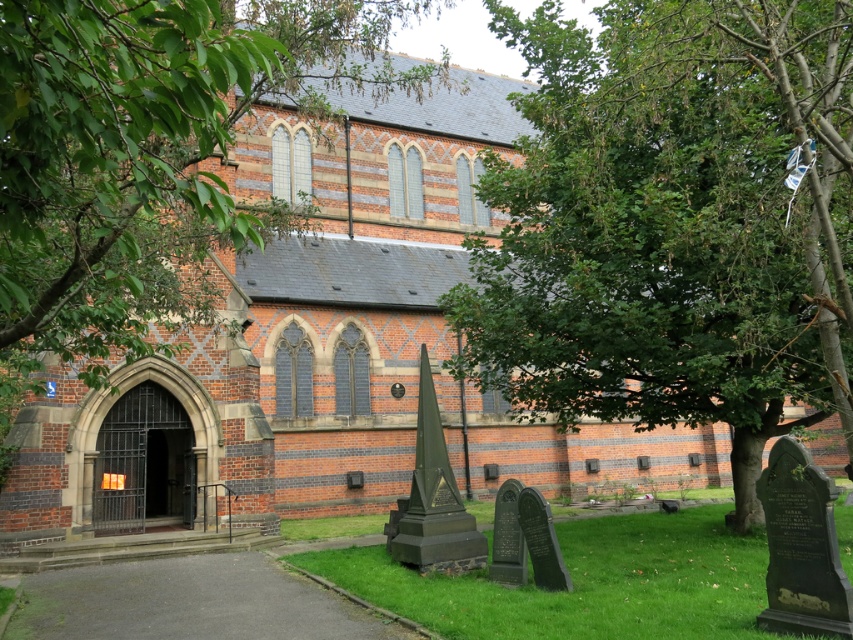
Question: Which of the following is the farthest from the observer?

Choices:
 (A) green grass at center
 (B) green leafy tree at center

Answer: (A)

Question: Can you confirm if green leafy tree at center is smaller than green grass at center?

Choices:
 (A) no
 (B) yes

Answer: (A)

Question: Which of these objects is positioned closest to the green leafy tree at center?

Choices:
 (A) green grass at center
 (B) green leafy tree at upper left

Answer: (A)

Question: Which object is the farthest from the green grass at center?

Choices:
 (A) green leafy tree at center
 (B) green leafy tree at upper left

Answer: (B)

Question: Can you confirm if green leafy tree at upper left is smaller than green grass at center?

Choices:
 (A) yes
 (B) no

Answer: (B)

Question: Does green leafy tree at upper left have a larger size compared to green grass at center?

Choices:
 (A) no
 (B) yes

Answer: (B)